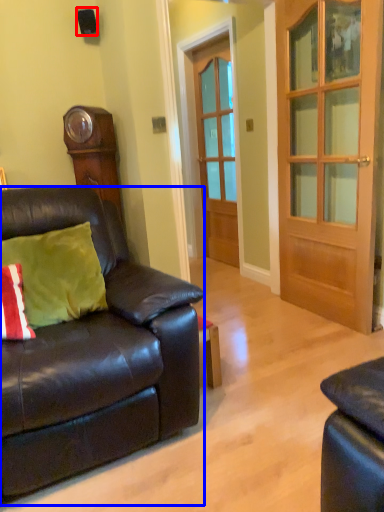
Question: Which object is further to the camera taking this photo, loudspeaker (highlighted by a red box) or studio couch (highlighted by a blue box)?

Choices:
 (A) loudspeaker
 (B) studio couch

Answer: (A)